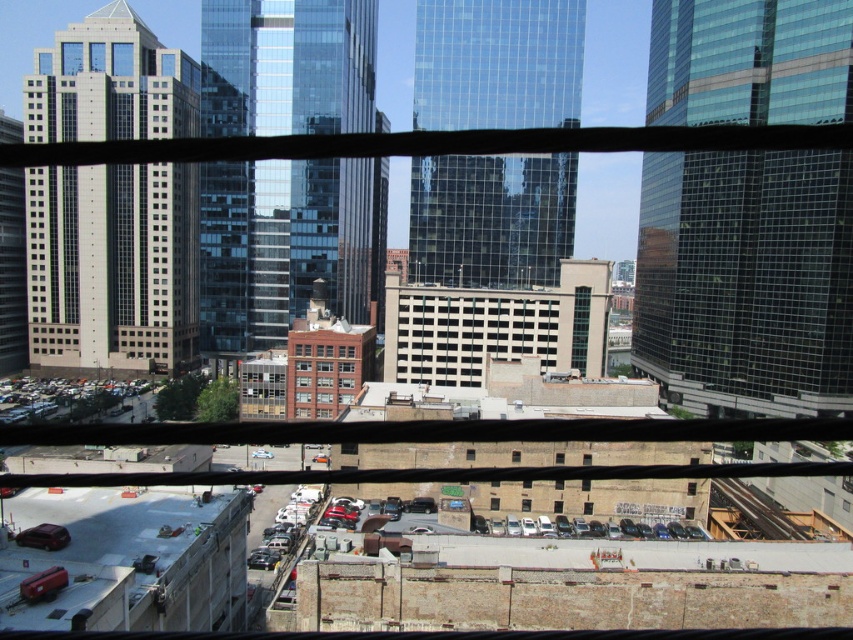
Question: Which point is closer to the camera?

Choices:
 (A) shiny metallic car at lower center
 (B) white concrete building at center
 (C) shiny silver car at lower center

Answer: (A)

Question: Is metallic silver car at lower center closer to camera compared to shiny metallic car at lower center?

Choices:
 (A) no
 (B) yes

Answer: (A)

Question: Among these points, which one is nearest to the camera?

Choices:
 (A) (294, 496)
 (B) (502, 531)
 (C) (428, 296)

Answer: (B)

Question: Which of the following is the closest to the observer?

Choices:
 (A) metallic silver car at lower center
 (B) white concrete building at center

Answer: (A)

Question: Can you confirm if brown brick building at center is positioned to the right of metallic silver car at lower center?

Choices:
 (A) yes
 (B) no

Answer: (B)

Question: From the image, what is the correct spatial relationship of metallic silver car at lower center in relation to shiny metallic car at lower center?

Choices:
 (A) right
 (B) left

Answer: (A)